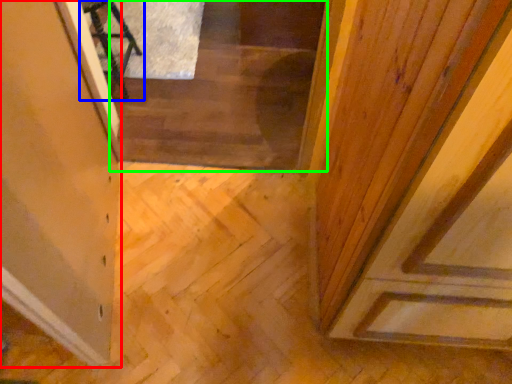
Question: Which is nearer to the glass door (highlighted by a red box)? furniture (highlighted by a blue box) or stairwell (highlighted by a green box).

Choices:
 (A) furniture
 (B) stairwell

Answer: (B)